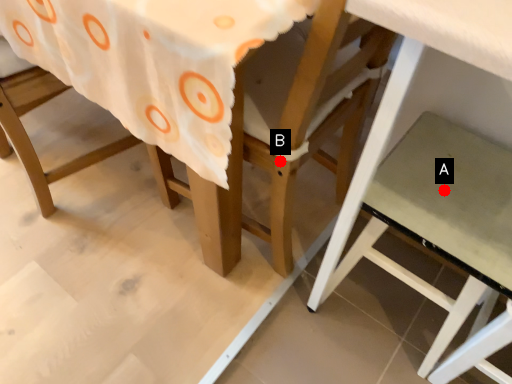
Question: Two points are circled on the image, labeled by A and B beside each circle. Which point is further to the camera?

Choices:
 (A) A is further
 (B) B is further

Answer: (B)